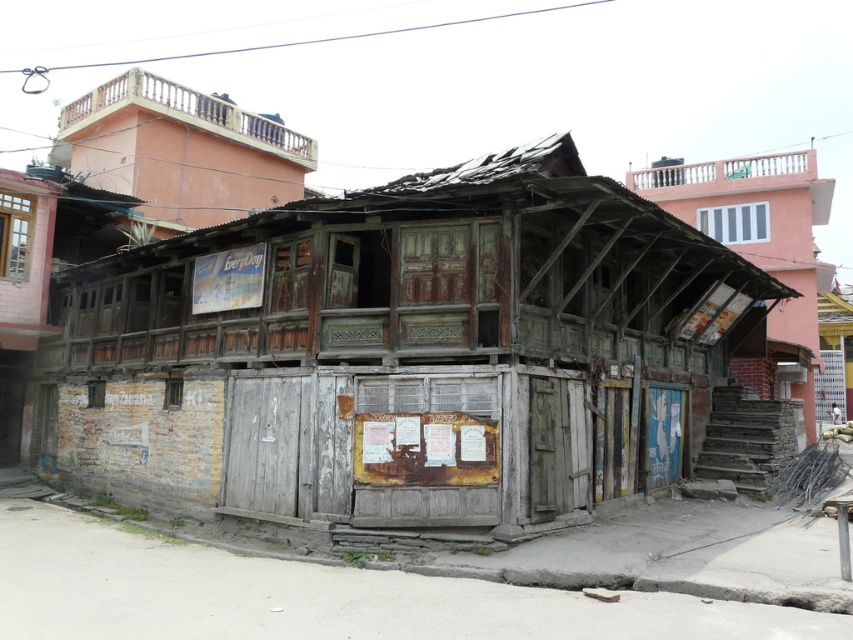
Question: Is weathered wood hut at center above wooden balcony at upper left?

Choices:
 (A) no
 (B) yes

Answer: (A)

Question: Which point is closer to the camera?

Choices:
 (A) (669, 240)
 (B) (238, 118)

Answer: (A)

Question: Does weathered wood hut at center lie in front of wooden balcony at upper left?

Choices:
 (A) yes
 (B) no

Answer: (A)

Question: Which point appears closest to the camera in this image?

Choices:
 (A) (73, 122)
 (B) (811, 188)

Answer: (A)

Question: Which point is farther from the camera taking this photo?

Choices:
 (A) (635, 400)
 (B) (804, 182)
 (C) (239, 211)

Answer: (B)

Question: Does weathered wood hut at center have a larger size compared to wooden balcony at upper left?

Choices:
 (A) no
 (B) yes

Answer: (B)